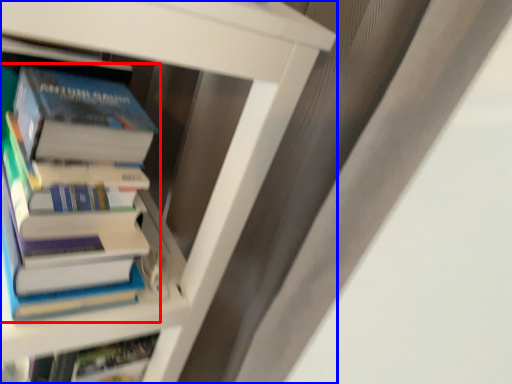
Question: Which object appears closest to the camera in this image, book (highlighted by a red box) or book (highlighted by a blue box)?

Choices:
 (A) book
 (B) book

Answer: (B)